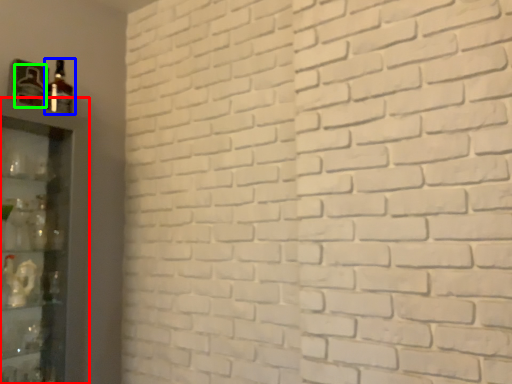
Question: Which object is positioned closest to shelf (highlighted by a red box)? Select from bottle (highlighted by a blue box) and bottle (highlighted by a green box).

Choices:
 (A) bottle
 (B) bottle

Answer: (B)